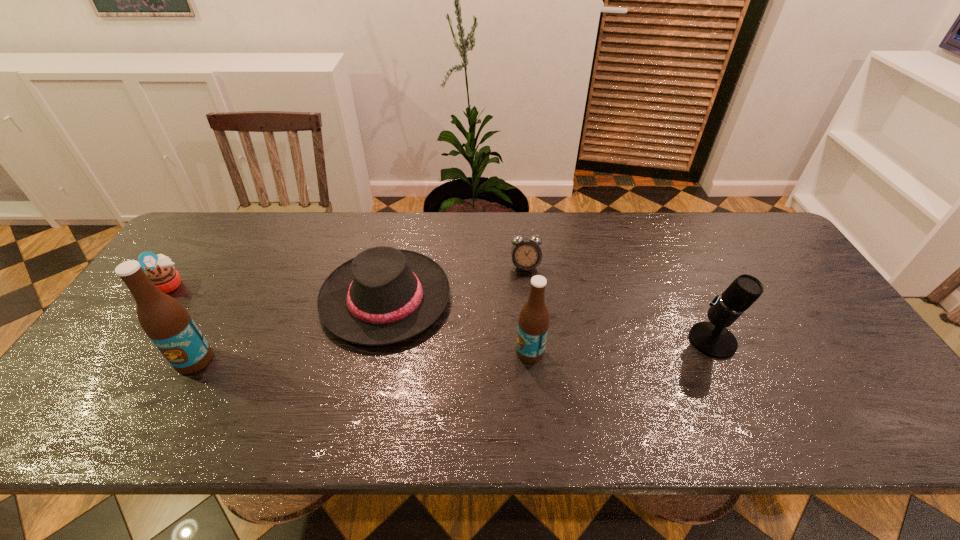
Identify the location of vacant region between the microphone and the dress hat. The height and width of the screenshot is (540, 960). (549, 320).

This screenshot has height=540, width=960. Find the location of `the fourth closest object to the leftmost object`. the fourth closest object to the leftmost object is located at coordinates (533, 323).

You are a GUI agent. You are given a task and a screenshot of the screen. Output one action in this format:
    pyautogui.click(x=<x>, y=<y>)
    Task: Click on the object that stands as the fourth closest to the rightmost object
    
    Given the screenshot: What is the action you would take?
    pyautogui.click(x=166, y=322)

Find the location of a particular element. The height and width of the screenshot is (540, 960). free spot that satisfies the following two spatial constraints: 1. on the back side of the right beer bottle; 2. on the right side of the taller beer bottle is located at coordinates (199, 352).

I want to click on free spot that satisfies the following two spatial constraints: 1. on the front-facing side of the leftmost object; 2. on the back side of the rightmost object, so click(x=130, y=341).

Locate an element on the screen. free space that satisfies the following two spatial constraints: 1. on the back side of the taller beer bottle; 2. on the front-facing side of the leftmost object is located at coordinates (237, 284).

Image resolution: width=960 pixels, height=540 pixels. I want to click on free space that satisfies the following two spatial constraints: 1. on the front-facing side of the fourth object from right to left; 2. on the right side of the leftmost object, so click(x=159, y=299).

Locate an element on the screen. This screenshot has height=540, width=960. vacant space that satisfies the following two spatial constraints: 1. on the front-facing side of the muffin; 2. on the back side of the right beer bottle is located at coordinates (122, 352).

Locate an element on the screen. Image resolution: width=960 pixels, height=540 pixels. free point that satisfies the following two spatial constraints: 1. on the face of the alarm clock; 2. on the front-facing side of the leftmost object is located at coordinates (527, 284).

I want to click on vacant space that satisfies the following two spatial constraints: 1. on the face of the third tallest object; 2. on the right side of the alarm clock, so click(x=533, y=341).